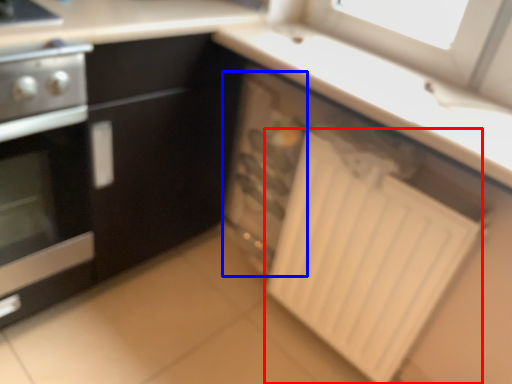
Question: Among these objects, which one is nearest to the camera, radiator (highlighted by a red box) or appliance (highlighted by a blue box)?

Choices:
 (A) radiator
 (B) appliance

Answer: (A)